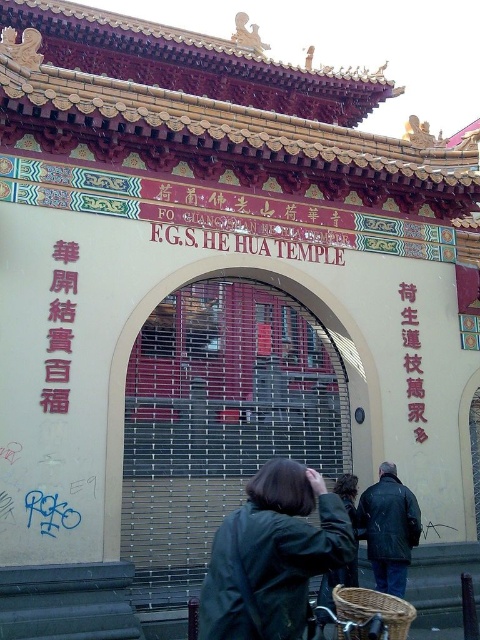
Which is behind, point (319, 509) or point (52, 257)?

Positioned behind is point (52, 257).

Does dark green jacket at center appear under pink paper text at upper left?

Correct, dark green jacket at center is located below pink paper text at upper left.

The height and width of the screenshot is (640, 480). Find the location of `dark green jacket at center`. dark green jacket at center is located at coordinates (272, 556).

Locate an element on the screen. Image resolution: width=480 pixels, height=640 pixels. dark green jacket at center is located at coordinates (272, 556).

Can you confirm if dark green jacket at center is positioned to the right of leather jacket at center?

In fact, dark green jacket at center is to the left of leather jacket at center.

Can you confirm if dark green jacket at center is wider than leather jacket at center?

Yes.

Is point (309, 545) farther from camera compared to point (395, 484)?

No, (309, 545) is closer to viewer.

The width and height of the screenshot is (480, 640). I want to click on dark green jacket at center, so tap(272, 556).

Can you confirm if metallic gate at center is taller than black matte bicycle at lower center?

Correct, metallic gate at center is much taller as black matte bicycle at lower center.

Is metallic gate at center wider than black matte bicycle at lower center?

Yes.

Is point (132, 436) in front of point (335, 621)?

No, (132, 436) is behind (335, 621).

The width and height of the screenshot is (480, 640). In order to click on metallic gate at center in this screenshot , I will do `click(228, 410)`.